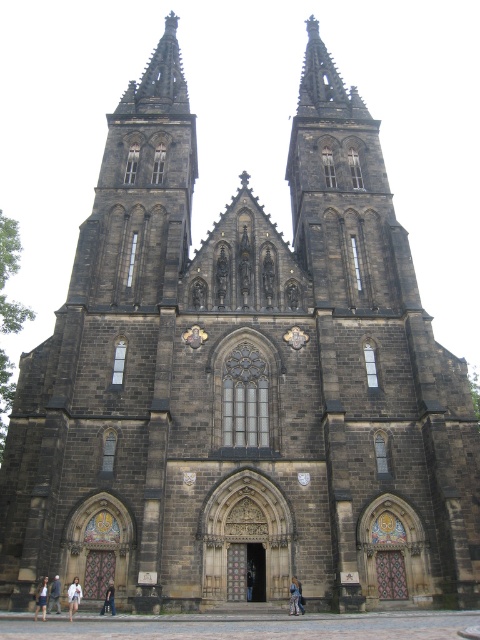
Question: Estimate the real-world distances between objects in this image. Which object is closer to the blue denim jeans at lower center?

Choices:
 (A) denim shorts at lower center
 (B) light blue denim jeans at lower left
 (C) light beige fabric coat at lower center

Answer: (C)

Question: Does light beige fabric coat at lower center have a smaller size compared to blue denim jeans at lower center?

Choices:
 (A) yes
 (B) no

Answer: (A)

Question: Which object is the closest to the blue denim jeans at lower center?

Choices:
 (A) light blue denim jeans at lower left
 (B) light beige fabric coat at lower center
 (C) light brown leather jacket at center
 (D) denim shorts at lower center

Answer: (C)

Question: Among these objects, which one is farthest from the camera?

Choices:
 (A) blue denim jeans at lower center
 (B) light blue denim jeans at lower left
 (C) light brown leather jacket at center
 (D) denim shorts at lower center

Answer: (B)

Question: Does light beige fabric coat at lower center appear over light blue denim jeans at lower left?

Choices:
 (A) yes
 (B) no

Answer: (B)

Question: Is blue denim jeans at lower center above light brown leather jacket at center?

Choices:
 (A) no
 (B) yes

Answer: (B)